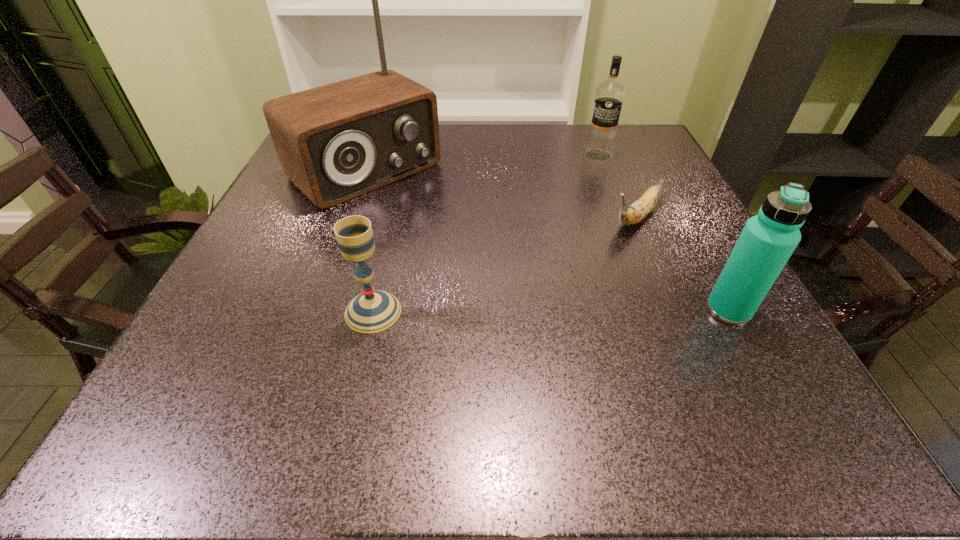
You are a GUI agent. You are given a task and a screenshot of the screen. Output one action in this format:
    pyautogui.click(x=<x>, y=<y>)
    Task: Click on the free space on the desktop that is between the second shortest object and the water bottle and is positioned on the label of the vodka
    This screenshot has height=540, width=960.
    Given the screenshot: What is the action you would take?
    pyautogui.click(x=536, y=310)

At what (x,y) coordinates should I click in order to perform the action: click on free space on the desktop that is between the second shortest object and the water bottle and is positioned on the front-facing side of the tallest object. Please return your answer as a coordinate pair (x, y). Looking at the image, I should click on (540, 310).

Where is `free spot on the desktop that is between the fourth tallest object and the water bottle and is positioned on the peel of the shortest object`? The width and height of the screenshot is (960, 540). free spot on the desktop that is between the fourth tallest object and the water bottle and is positioned on the peel of the shortest object is located at coordinates (526, 311).